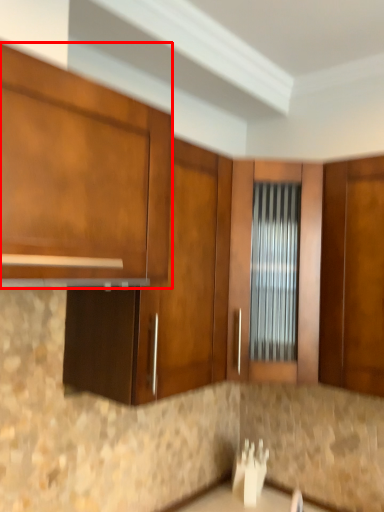
Question: Observing the image, what is the correct spatial positioning of cabinetry (annotated by the red box) in reference to cabinetry?

Choices:
 (A) right
 (B) left

Answer: (B)